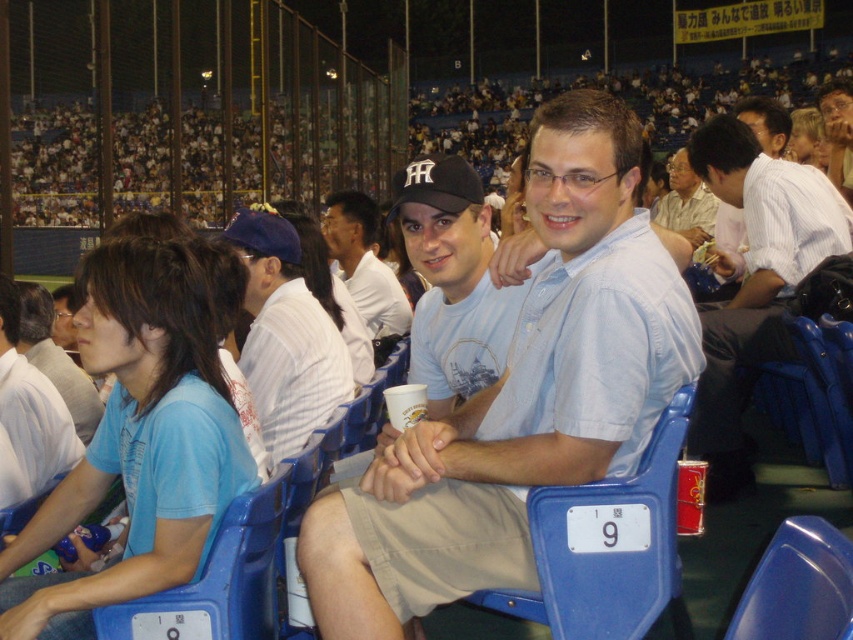
Question: Is light blue cotton shirt at center above white cotton shirt at center?

Choices:
 (A) yes
 (B) no

Answer: (B)

Question: Which point appears farthest from the camera in this image?

Choices:
 (A) (579, 518)
 (B) (379, 330)
 (C) (734, 124)
 (D) (772, 538)

Answer: (B)

Question: Is blue plastic chair at center wider than matte white shirt at center?

Choices:
 (A) yes
 (B) no

Answer: (B)

Question: Which object appears farthest from the camera in this image?

Choices:
 (A) blue plastic chair at center
 (B) white striped shirt at right
 (C) blue cotton shirt at left
 (D) light blue cotton shirt at center

Answer: (B)

Question: Can you confirm if blue plastic chair at center is positioned above blue plastic chair at lower right?

Choices:
 (A) yes
 (B) no

Answer: (B)

Question: Among these objects, which one is farthest from the camera?

Choices:
 (A) blue cotton shirt at left
 (B) light blue cotton shirt at center
 (C) white striped shirt at right
 (D) white striped shirt at center

Answer: (C)